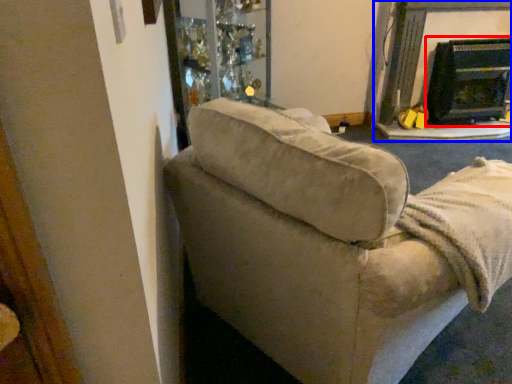
Question: Which object appears closest to the camera in this image, fireplace (highlighted by a red box) or fireplace (highlighted by a blue box)?

Choices:
 (A) fireplace
 (B) fireplace

Answer: (B)